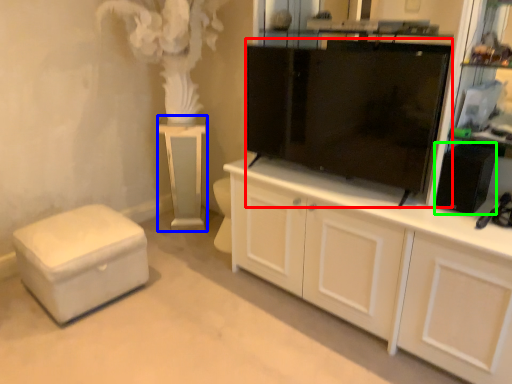
Question: Which object is positioned closest to tv cabinet (highlighted by a red box)? Select from table (highlighted by a blue box) and appliance (highlighted by a green box).

Choices:
 (A) table
 (B) appliance

Answer: (B)